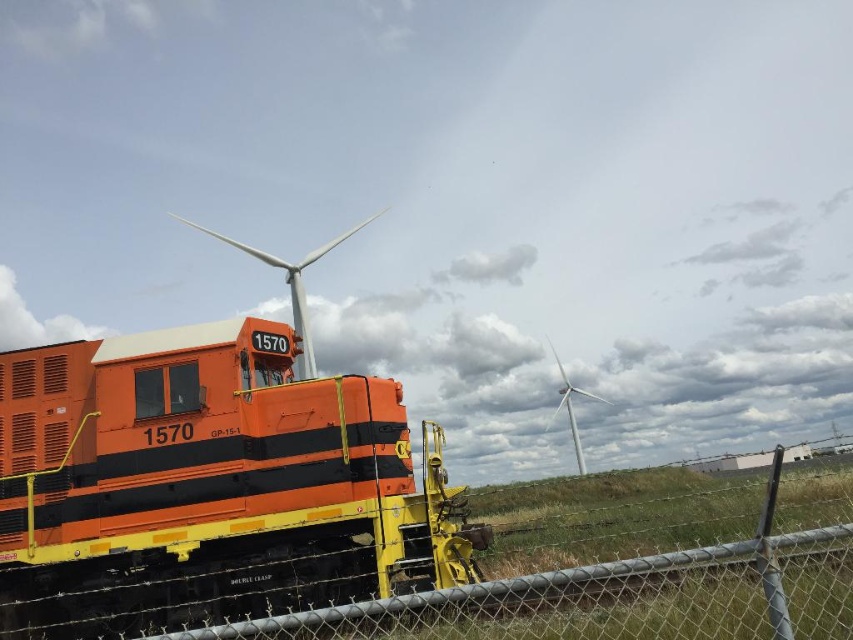
You are a photographer trying to capture both the white matte wind turbine at upper center and the white metallic wind turbine at center in a single shot. Which turbine should you focus on first to ensure both are in the frame?

You should focus on the white matte wind turbine at upper center first because it is larger in size compared to the white metallic wind turbine at center, ensuring it fits well within the frame while still capturing the smaller one.

You are standing in front of the chain link fence near the diesel locomotive numbered 1570. You want to take a photo of both the white matte wind turbine at upper center and the white metallic wind turbine at center. Which turbine should you angle your camera towards first to ensure both are in the frame?

A: You should angle your camera towards the white metallic wind turbine at center first because the white matte wind turbine at upper center is closer to the viewer, so adjusting the angle to include the farther turbine ensures both are captured in the frame.